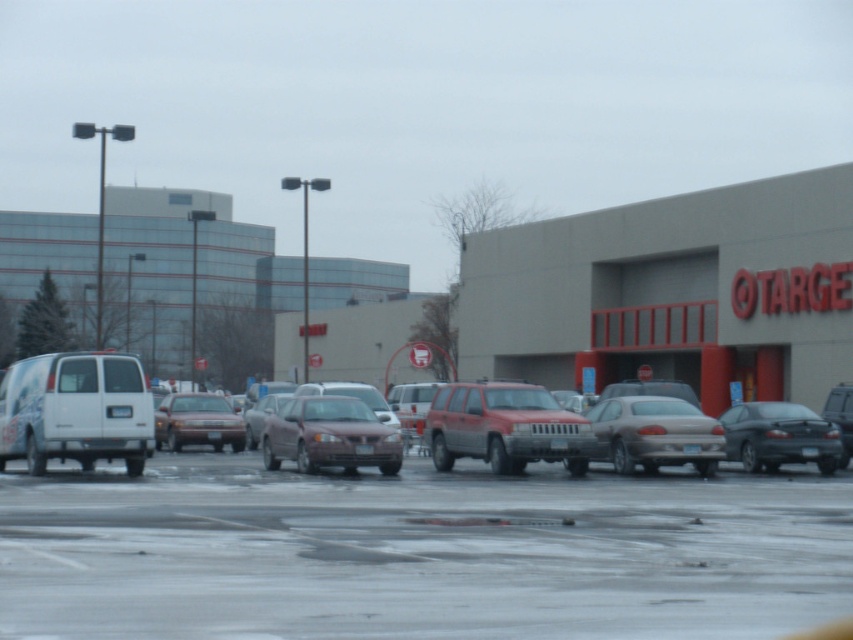
From the picture: You are standing in the parking lot of the Target store and want to walk to the entrance. Which object, the gray concrete mall at center or the dark gray metallic sedan at right, will you pass closer to first?

The dark gray metallic sedan at right is closer to you than the gray concrete mall at center, so you will pass closer to the dark gray metallic sedan at right first.

You are a delivery driver who needs to back your truck into the parking spot next to the white matte van at left. The parking spot is located on the smooth asphalt parking lot at center. Can you safely back into the spot without hitting the van if your truck requires 14 feet of clearance?

The smooth asphalt parking lot at center is 13.78 feet from the white matte van at left. Since the truck requires 14 feet of clearance, there is not enough space to safely back into the spot without hitting the van.

You are a delivery driver who needs to park your truck between the white matte van at left and the dark gray metallic sedan at right. Based on the scene, can you fit your truck there?

The white matte van at left is above the dark gray metallic sedan at right, meaning there is no space between them for the truck to park.